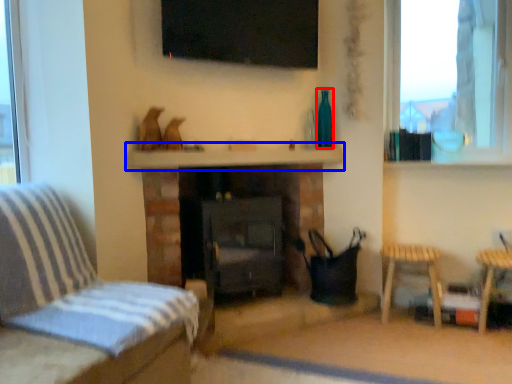
Question: Which of the following is the closest to the observer, bottle (highlighted by a red box) or mantle (highlighted by a blue box)?

Choices:
 (A) bottle
 (B) mantle

Answer: (B)